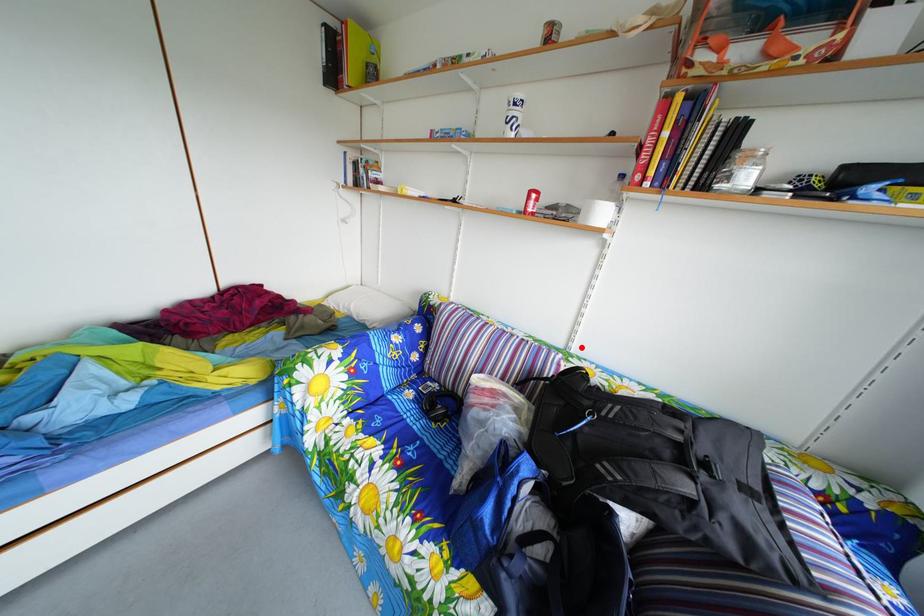
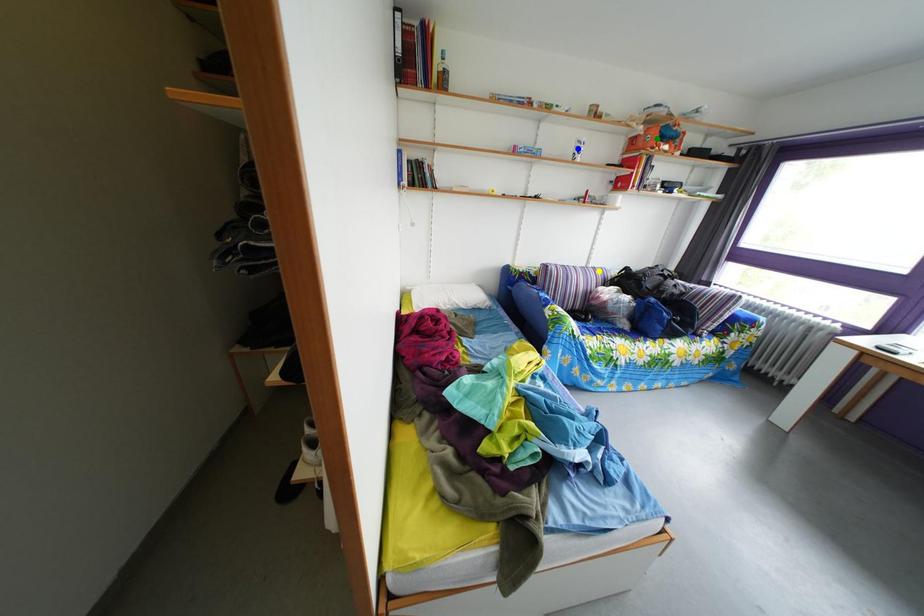
Question: I am providing you with two images of the same scene from different viewpoints. A red point is marked on the first image. You are given multiple points on the second image. Which point in image 2 represents the same 3d spot as the red point in image 1?

Choices:
 (A) yellow point
 (B) blue point
 (C) green point

Answer: (A)